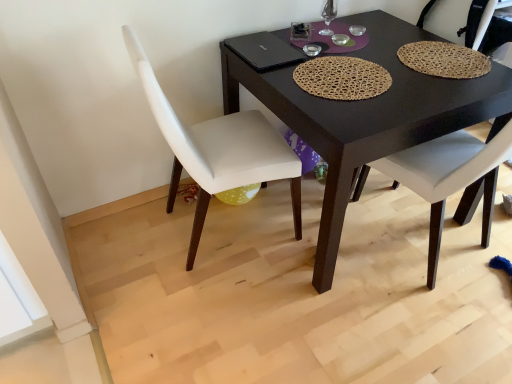
The width and height of the screenshot is (512, 384). I want to click on free space to the left of white leather chair at lower left, the 1th chair positioned from the left, so click(125, 245).